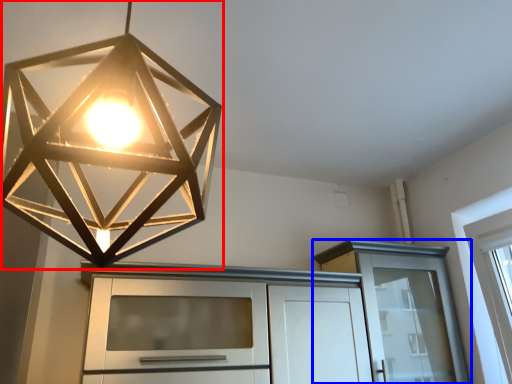
Question: Which point is closer to the camera, lamp (highlighted by a red box) or cabinetry (highlighted by a blue box)?

Choices:
 (A) lamp
 (B) cabinetry

Answer: (A)